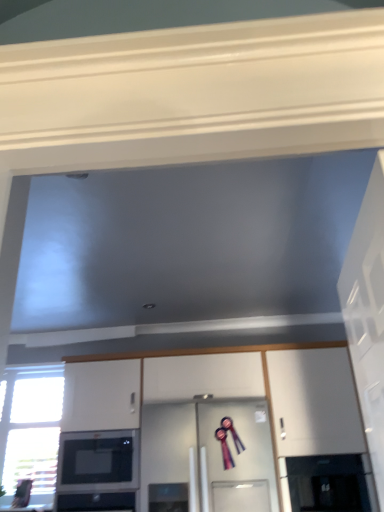
Question: Would you say white glossy cabinet at center is to the left or to the right of black glossy microwave at lower left in the picture?

Choices:
 (A) left
 (B) right

Answer: (B)

Question: From a real-world perspective, is white glossy cabinet at center physically located above or below black glossy microwave at lower left?

Choices:
 (A) below
 (B) above

Answer: (B)

Question: Estimate the real-world distances between objects in this image. Which object is farther from the white glossy cabinet at center?

Choices:
 (A) white glossy door at right
 (B) transparent glass door at lower right, which is counted as the second glass door, starting from the left
 (C) clear glass door at center, which is the 2th glass door from right to left
 (D) clear glass window at lower left
 (E) black glossy microwave at lower left

Answer: (A)

Question: Estimate the real-world distances between objects in this image. Which object is farther from the transparent glass door at lower right, marked as the first glass door in a right-to-left arrangement?

Choices:
 (A) clear glass window at lower left
 (B) white glossy door at right
 (C) white glossy cabinet at center
 (D) clear glass door at center, arranged as the first glass door when viewed from the left
 (E) black glossy microwave at lower left

Answer: (A)